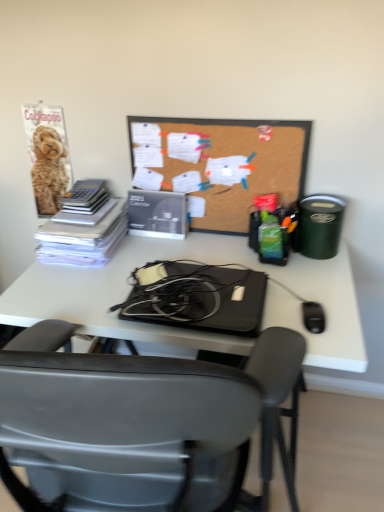
The width and height of the screenshot is (384, 512). Identify the location of vacant space in front of white paper stack at left. (77, 280).